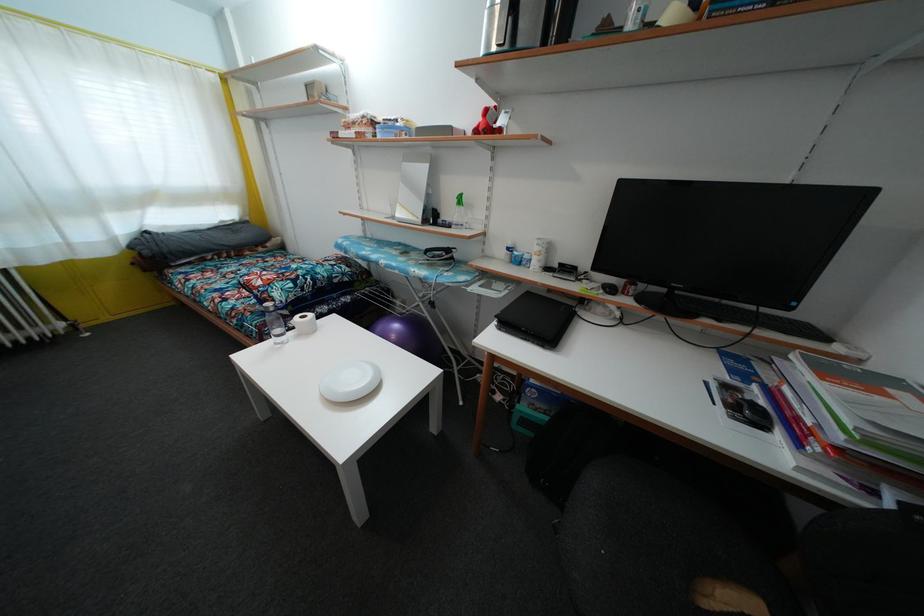
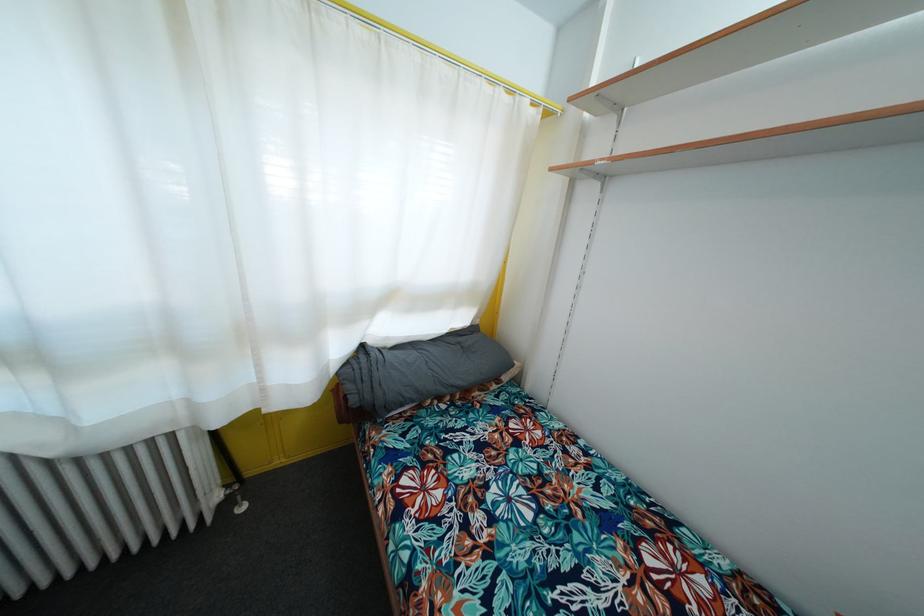
Locate, in the second image, the point that corresponds to (x=150, y=259) in the first image.

(358, 407)